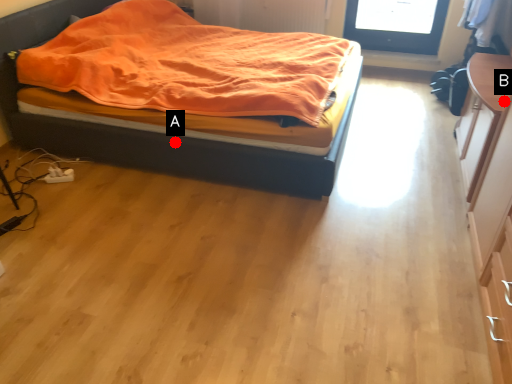
Question: Two points are circled on the image, labeled by A and B beside each circle. Which point is closer to the camera?

Choices:
 (A) A is closer
 (B) B is closer

Answer: (B)